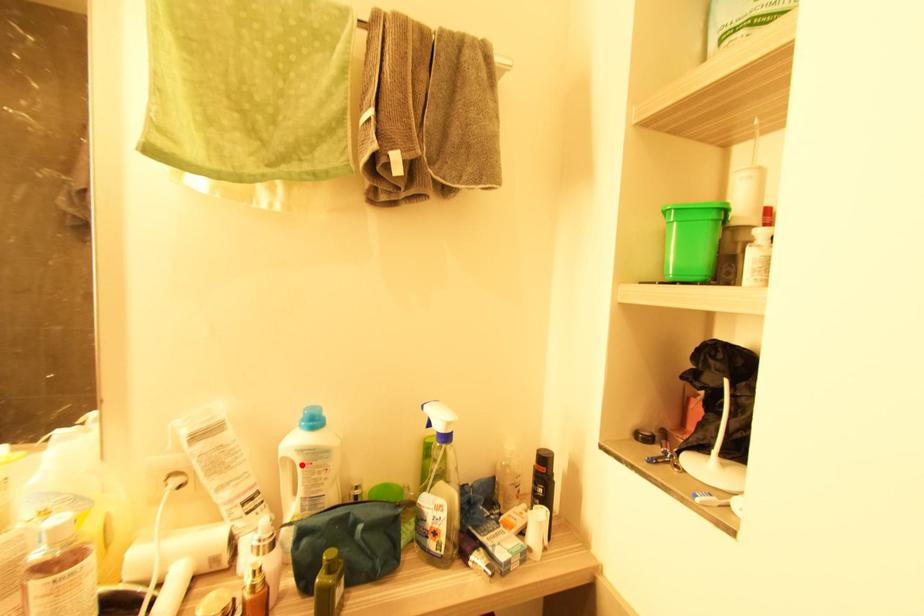
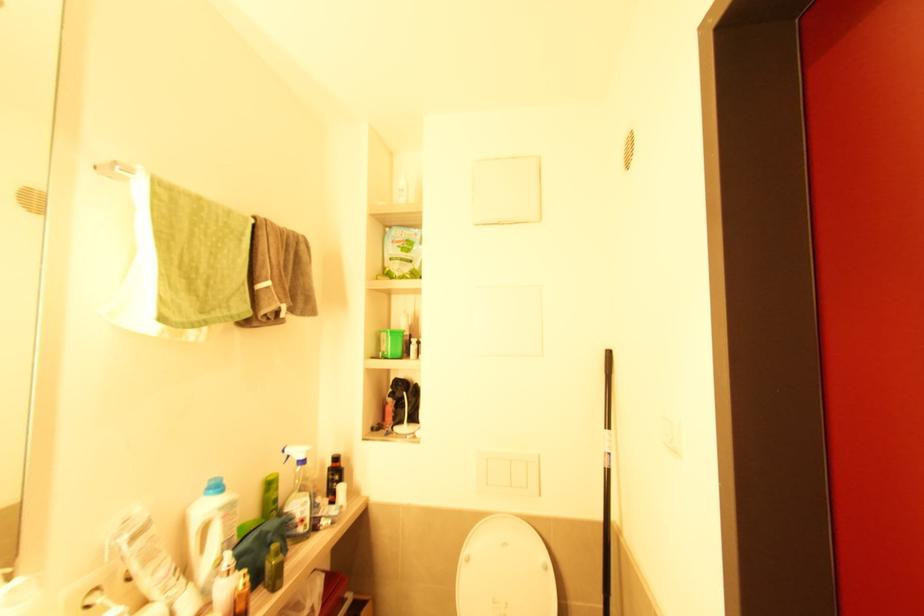
The point at the highlighted location is marked in the first image. Where is the corresponding point in the second image?

(224, 519)